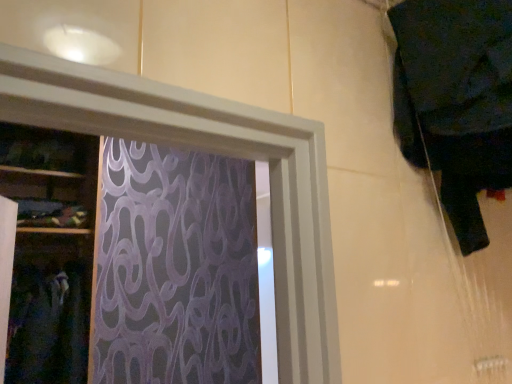
Question: From the image's perspective, is dark fabric at left, the first clothing when ordered from bottom to top, above or below dark fabric at upper right, the 1th clothing when ordered from right to left?

Choices:
 (A) above
 (B) below

Answer: (B)

Question: Looking at the image, does dark fabric at left, marked as the 2th clothing in a right-to-left arrangement, seem bigger or smaller compared to dark fabric at upper right, positioned as the 1th clothing in top-to-bottom order?

Choices:
 (A) big
 (B) small

Answer: (A)

Question: Is dark fabric at left, the first clothing from the back, in front of or behind dark fabric at upper right, positioned as the 1th clothing in top-to-bottom order, in the image?

Choices:
 (A) behind
 (B) front

Answer: (A)

Question: From the image's perspective, is dark fabric at upper right, the 2th clothing in the left-to-right sequence, located above or below dark fabric at left, the first clothing from the back?

Choices:
 (A) below
 (B) above

Answer: (B)

Question: Considering the positions of point (444, 31) and point (58, 292), is point (444, 31) closer or farther from the camera than point (58, 292)?

Choices:
 (A) farther
 (B) closer

Answer: (B)

Question: Relative to dark fabric at left, the second clothing viewed from the top, is dark fabric at upper right, positioned as the 1th clothing in top-to-bottom order, in front or behind?

Choices:
 (A) front
 (B) behind

Answer: (A)

Question: From a real-world perspective, is dark fabric at upper right, the second clothing from the back, positioned above or below dark fabric at left, the 2th clothing when ordered from front to back?

Choices:
 (A) above
 (B) below

Answer: (A)